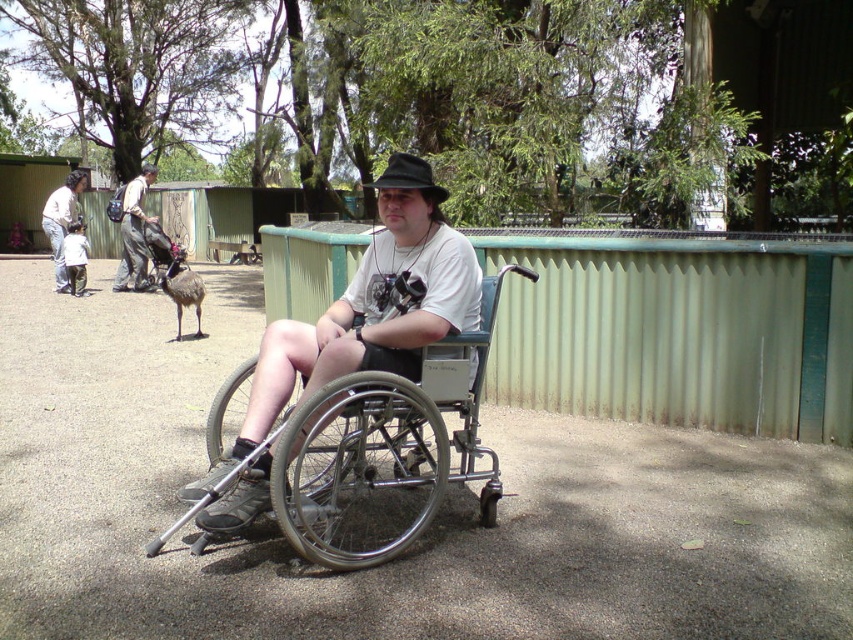
Who is taller, light brown leather backpack at upper left or black felt hat at center?

light brown leather backpack at upper left

Who is lower down, light brown leather backpack at upper left or black felt hat at center?

black felt hat at center is below.

Who is more forward, (138,280) or (397,164)?

Point (397,164) is in front.

Locate an element on the screen. Image resolution: width=853 pixels, height=640 pixels. light brown leather backpack at upper left is located at coordinates (134, 232).

Is point (373, 548) in front of point (74, 196)?

Yes.

Between silver metallic wheelchair at center and light brown leather jacket at upper left, which one appears on the right side from the viewer's perspective?

Positioned to the right is silver metallic wheelchair at center.

Locate an element on the screen. silver metallic wheelchair at center is located at coordinates (386, 442).

Looking at this image, between light brown leather jacket at upper left and black felt hat at center, which one has more height?

light brown leather jacket at upper left

Between point (50, 243) and point (413, 157), which one is positioned behind?

Point (50, 243)

Find the location of a particular element. The height and width of the screenshot is (640, 853). light brown leather jacket at upper left is located at coordinates click(62, 221).